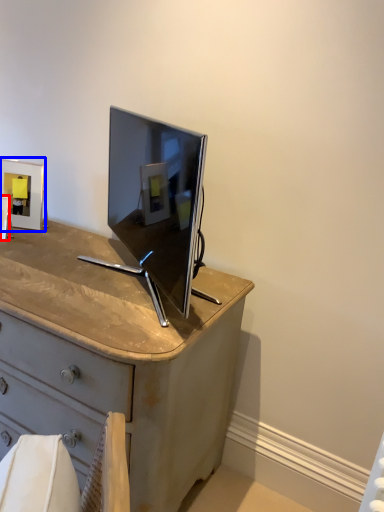
Question: Which object is further to the camera taking this photo, picture frame (highlighted by a red box) or picture frame (highlighted by a blue box)?

Choices:
 (A) picture frame
 (B) picture frame

Answer: (B)